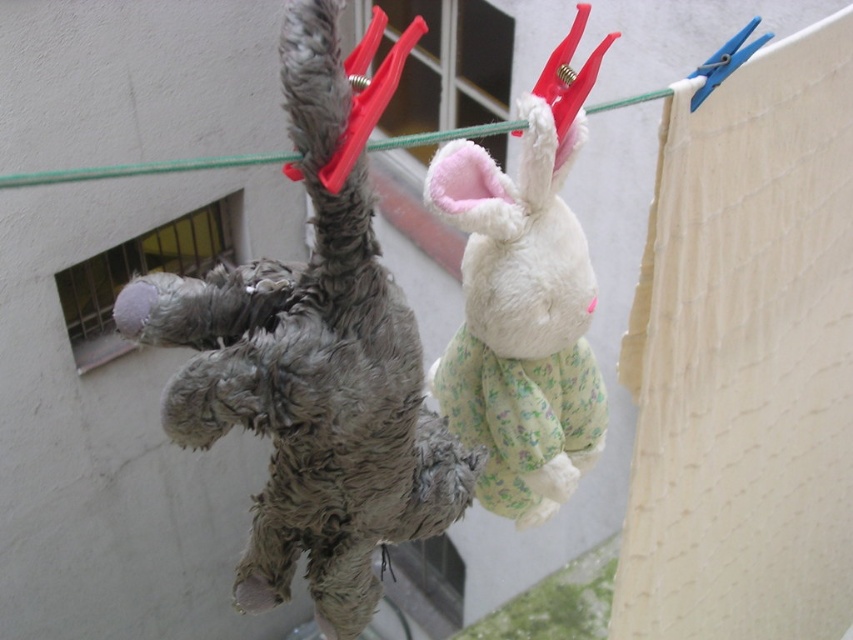
Question: Is fuzzy gray stuffed animal at left closer to the viewer compared to white plush rabbit at center?

Choices:
 (A) yes
 (B) no

Answer: (A)

Question: Does fuzzy gray stuffed animal at left appear on the right side of white plush rabbit at center?

Choices:
 (A) yes
 (B) no

Answer: (B)

Question: Is fuzzy gray stuffed animal at left wider than white plush rabbit at center?

Choices:
 (A) yes
 (B) no

Answer: (A)

Question: Which point is closer to the camera?

Choices:
 (A) tap(305, 515)
 (B) tap(572, 262)

Answer: (A)